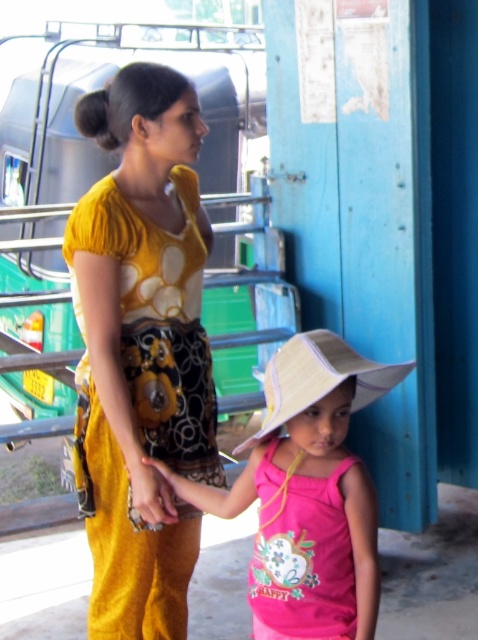
You are a photographer trying to capture a photo of the yellow printed dress at center and the pink fabric hat at center. If you want to ensure both are fully visible in the frame, which object should you focus on to avoid cropping?

The pink fabric hat at center has a greater width than the yellow printed dress at center, so focusing on the pink fabric hat at center will ensure both are fully visible without cropping.

You are a photographer trying to capture a clear photo of both the yellow printed dress at center and the pink fabric hat at center. Since you want both to be visible, which object should you focus on first to ensure proper focus, considering their sizes?

The yellow printed dress at center has a larger size compared to the pink fabric hat at center. Therefore, you should focus on the yellow printed dress at center first since it is larger and will require more precise focus to capture details clearly.